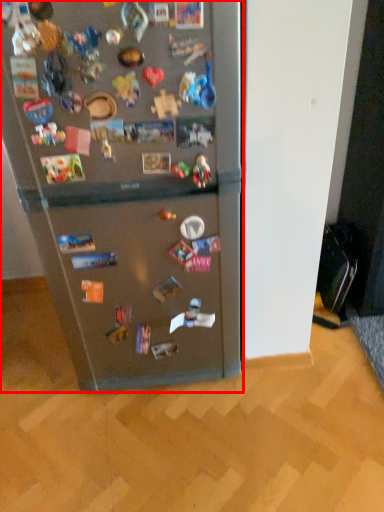
Question: In this image, where is refrigerator (annotated by the red box) located relative to toy?

Choices:
 (A) right
 (B) left

Answer: (B)